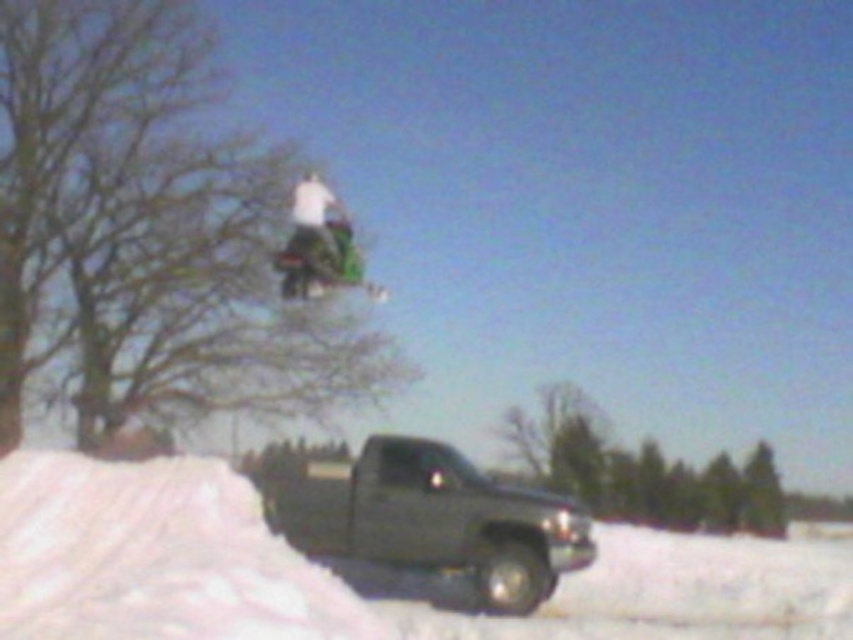
Question: Can you confirm if matte black truck at lower center is smaller than green plastic snowboard at upper center?

Choices:
 (A) yes
 (B) no

Answer: (B)

Question: Does matte black truck at lower center appear under green plastic snowboard at upper center?

Choices:
 (A) no
 (B) yes

Answer: (B)

Question: Which point appears closest to the camera in this image?

Choices:
 (A) (337, 200)
 (B) (344, 556)

Answer: (B)

Question: Which point appears closest to the camera in this image?

Choices:
 (A) (293, 250)
 (B) (364, 458)

Answer: (A)

Question: Which object is farther from the camera taking this photo?

Choices:
 (A) green plastic snowboard at upper center
 (B) matte black truck at lower center

Answer: (A)

Question: Is matte black truck at lower center further to the viewer compared to green plastic snowboard at upper center?

Choices:
 (A) no
 (B) yes

Answer: (A)